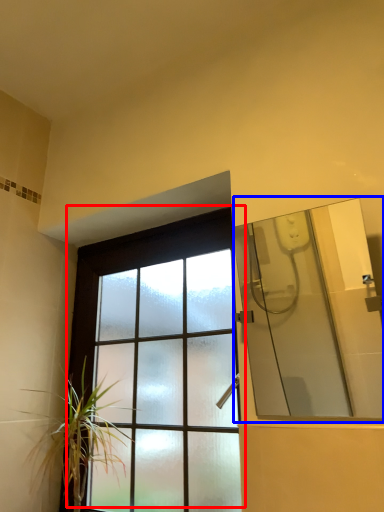
Question: Which object is further to the camera taking this photo, window (highlighted by a red box) or mirror (highlighted by a blue box)?

Choices:
 (A) window
 (B) mirror

Answer: (A)